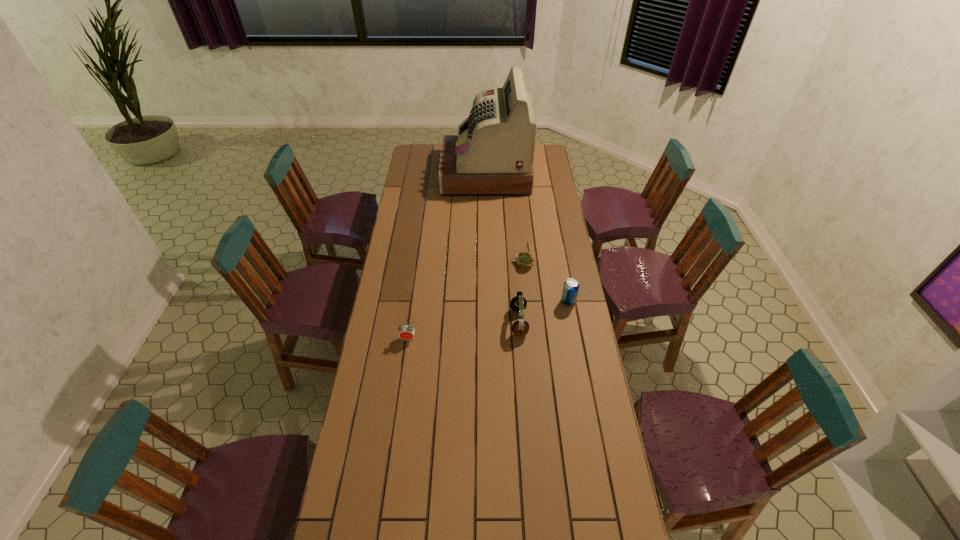
This screenshot has width=960, height=540. I want to click on free space that satisfies the following two spatial constraints: 1. on the operating side of the beer can; 2. on the left side of the cash register, so click(488, 301).

Image resolution: width=960 pixels, height=540 pixels. Identify the location of vacant area that satisfies the following two spatial constraints: 1. with the dial facing the compass; 2. on the face of the leftmost object. (531, 339).

Image resolution: width=960 pixels, height=540 pixels. In order to click on vacant region that satisfies the following two spatial constraints: 1. on the ear cups of the headset; 2. on the face of the alarm clock in this screenshot , I will do `click(520, 339)`.

Where is `free space that satisfies the following two spatial constraints: 1. on the operating side of the tallest object; 2. on the face of the leftmost object`? The width and height of the screenshot is (960, 540). free space that satisfies the following two spatial constraints: 1. on the operating side of the tallest object; 2. on the face of the leftmost object is located at coordinates (488, 339).